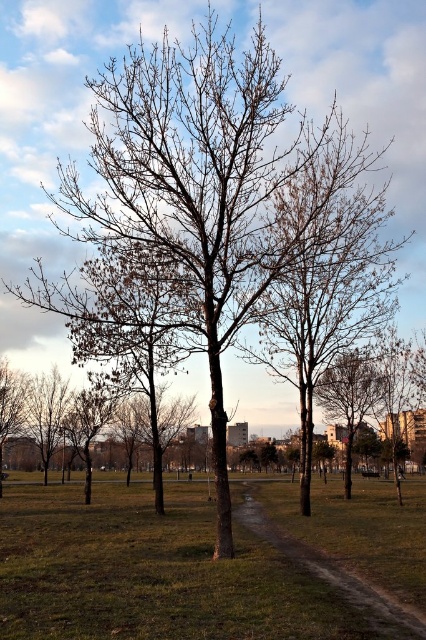
The width and height of the screenshot is (426, 640). Describe the element at coordinates (152, 573) in the screenshot. I see `green grass at center` at that location.

Who is taller, green grass at center or bare branches at right?

bare branches at right

Is point (141, 589) farther from viewer compared to point (331, 364)?

No.

You are a GUI agent. You are given a task and a screenshot of the screen. Output one action in this format:
    pyautogui.click(x=<x>, y=<y>)
    Task: Click on the green grass at center
    The image size is (426, 640).
    Given the screenshot: What is the action you would take?
    pyautogui.click(x=152, y=573)

Which is above, grassy dirt path at center or bare branches at right?

bare branches at right is above.

Based on the photo, can you confirm if grassy dirt path at center is taller than bare branches at right?

In fact, grassy dirt path at center may be shorter than bare branches at right.

Is point (256, 524) positioned in front of point (348, 428)?

Yes, point (256, 524) is closer to viewer.

This screenshot has width=426, height=640. Find the location of `grassy dirt path at center`. grassy dirt path at center is located at coordinates (334, 560).

Who is lower down, green grass at center or grassy dirt path at center?

Positioned lower is green grass at center.

Does green grass at center have a lesser height compared to grassy dirt path at center?

In fact, green grass at center may be taller than grassy dirt path at center.

Locate an element on the screen. green grass at center is located at coordinates (152, 573).